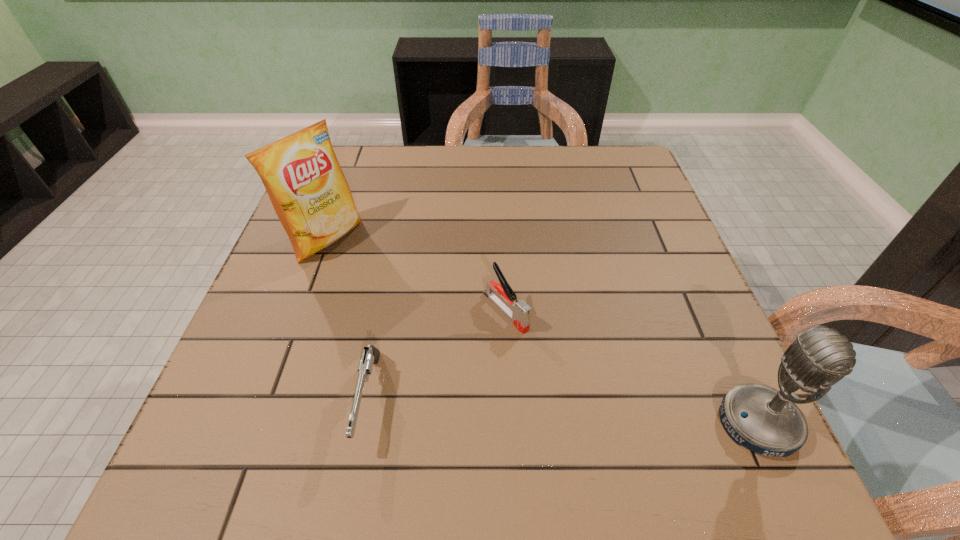
Locate an element on the screen. This screenshot has width=960, height=540. pistol is located at coordinates (371, 355).

Locate an element on the screen. This screenshot has width=960, height=540. the second object from left to right is located at coordinates (371, 355).

Locate an element on the screen. the rightmost object is located at coordinates (764, 420).

Locate an element on the screen. The width and height of the screenshot is (960, 540). crisp (potato chip) is located at coordinates (301, 174).

You are a GUI agent. You are given a task and a screenshot of the screen. Output one action in this format:
    pyautogui.click(x=<x>, y=<y>)
    Task: Click on the farthest object
    Image resolution: width=960 pixels, height=540 pixels.
    Given the screenshot: What is the action you would take?
    pyautogui.click(x=301, y=174)

You are a GUI agent. You are given a task and a screenshot of the screen. Output one action in this format:
    pyautogui.click(x=<x>, y=<y>)
    Task: Click on the third tallest object
    Image resolution: width=960 pixels, height=540 pixels.
    Given the screenshot: What is the action you would take?
    pyautogui.click(x=517, y=311)

I want to click on the second farthest object, so click(x=517, y=311).

Locate an element on the screen. vacant space situated on the front-facing side of the farthest object is located at coordinates (404, 291).

What are the coordinates of `vacant position located 0.220m on the front-facing side of the farthest object` in the screenshot? It's located at (418, 300).

This screenshot has width=960, height=540. What are the coordinates of `vacant area located 0.330m on the front-facing side of the farthest object` in the screenshot? It's located at (459, 326).